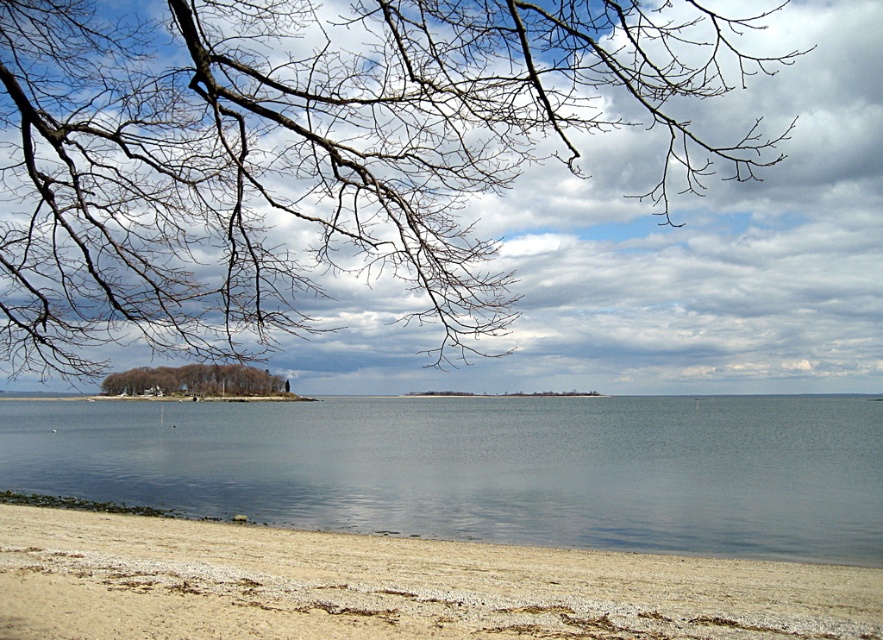
In the scene shown: Can you confirm if clear water at lower center is thinner than brown textured island at lower left?

In fact, clear water at lower center might be wider than brown textured island at lower left.

Which is more to the left, clear water at lower center or brown textured island at lower left?

brown textured island at lower left

The height and width of the screenshot is (640, 883). What are the coordinates of `clear water at lower center` in the screenshot? It's located at (487, 467).

Which is more to the left, bare branches at upper left or brown textured island at lower left?

brown textured island at lower left is more to the left.

What do you see at coordinates (310, 156) in the screenshot? I see `bare branches at upper left` at bounding box center [310, 156].

The width and height of the screenshot is (883, 640). I want to click on bare branches at upper left, so click(310, 156).

Between bare branches at upper left and clear water at lower center, which one appears on the left side from the viewer's perspective?

Positioned to the left is clear water at lower center.

Can you confirm if bare branches at upper left is shorter than clear water at lower center?

Yes, bare branches at upper left is shorter than clear water at lower center.

At what (x,y) coordinates should I click in order to perform the action: click on bare branches at upper left. Please return your answer as a coordinate pair (x, y). This screenshot has width=883, height=640. Looking at the image, I should click on (310, 156).